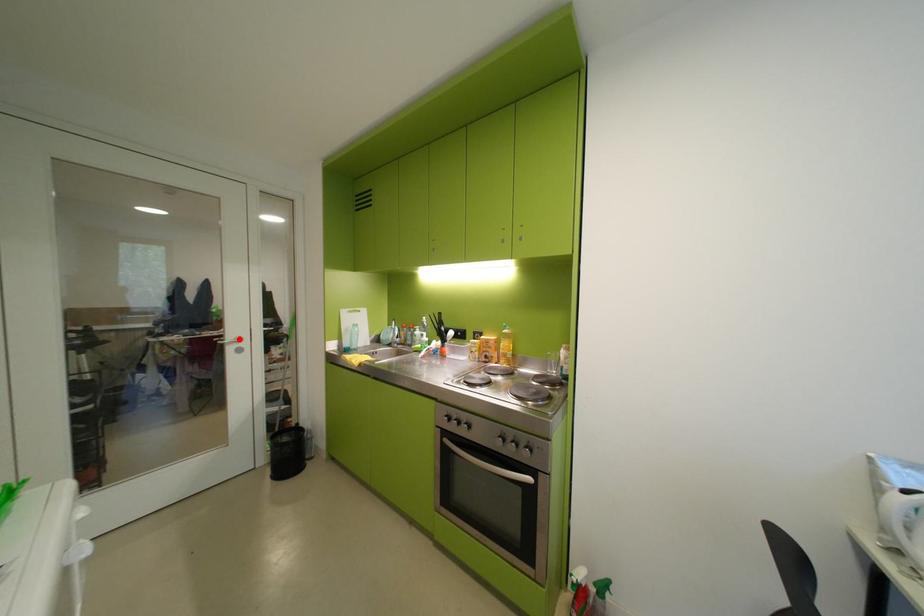
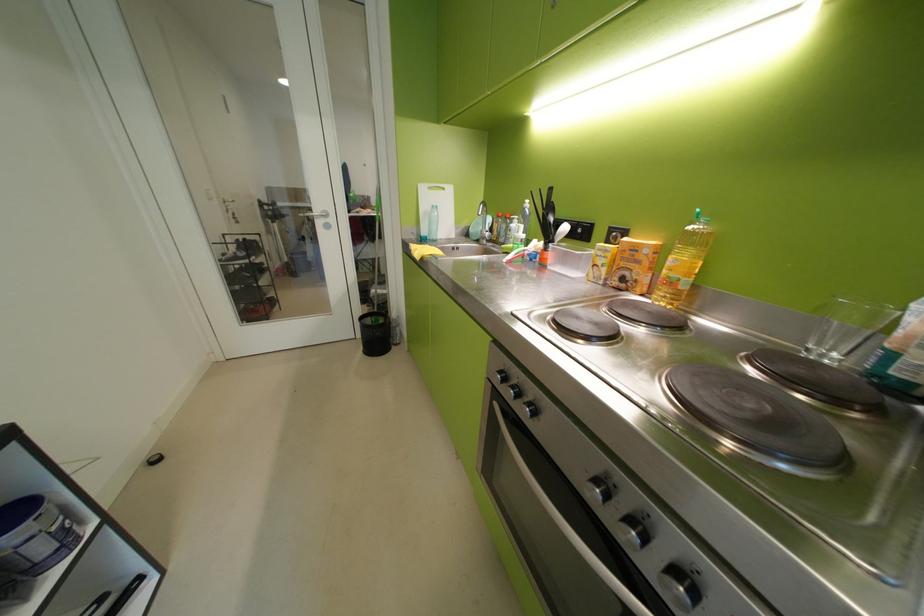
Locate, in the second image, the point that corresponds to the highlighted location in the first image.

(326, 213)